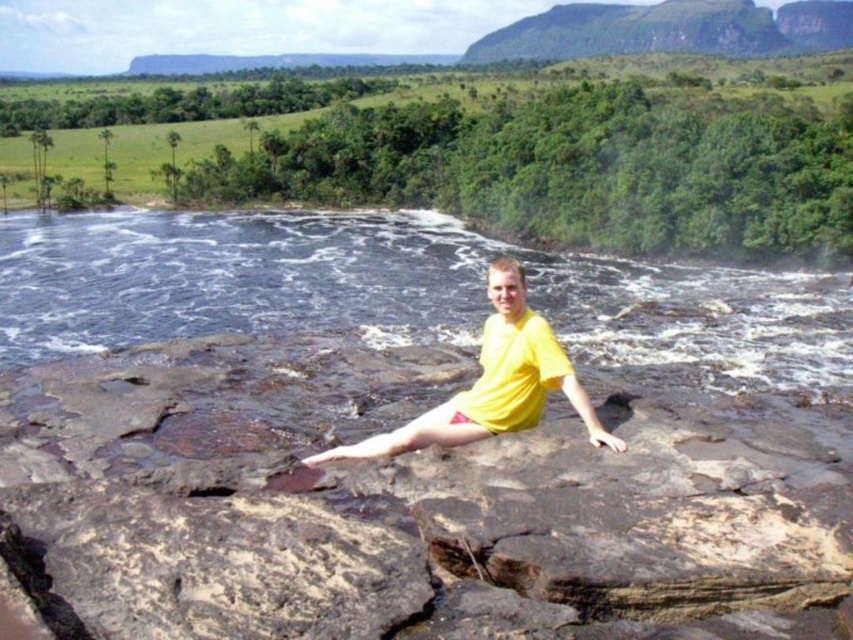
You are a photographer trying to capture a photo of the yellow matte shirt at center and the black water at center. Based on their positions, which one should you focus on first if you want to ensure both are in sharp focus?

The yellow matte shirt at center should be focused on first because it is closer to the camera than the black water at center, which is further away. By focusing on the closer object, the background object will also be in focus due to depth of field.